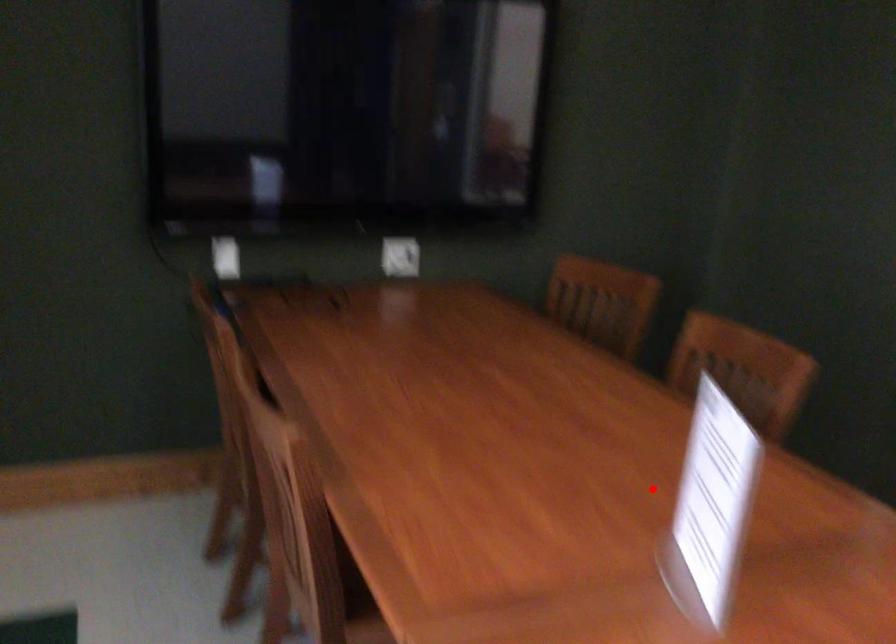
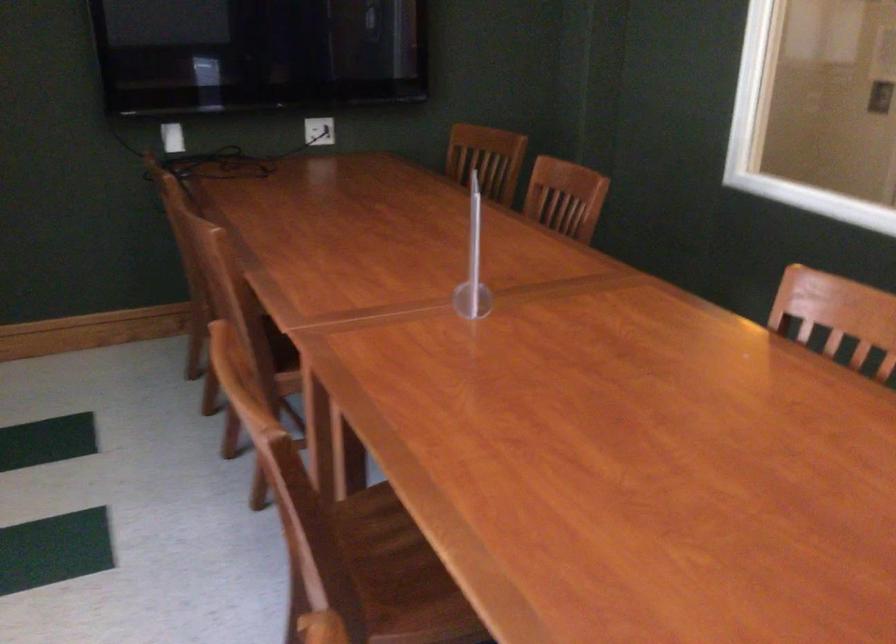
Question: I am providing you with two images of the same scene from different viewpoints. Given a red point in image1, look at the same physical point in image2. Is it:

Choices:
 (A) Closer to the viewpoint
 (B) Farther from the viewpoint

Answer: (B)